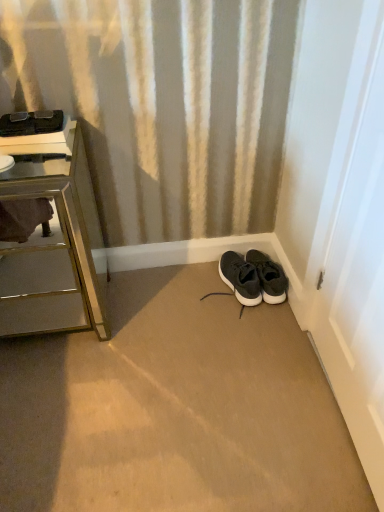
The image size is (384, 512). In order to click on free region on the left part of black matte sneakers at lower right in this screenshot , I will do `click(212, 287)`.